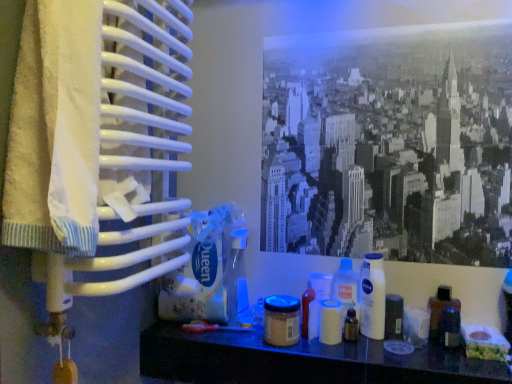
Question: In terms of width, does monochrome cityscape at upper center look wider or thinner when compared to translucent plastic tube at center, the fifth toiletry from the right?

Choices:
 (A) thin
 (B) wide

Answer: (A)

Question: From a real-world perspective, is monochrome cityscape at upper center physically located above or below translucent plastic tube at center, the fifth toiletry from the right?

Choices:
 (A) below
 (B) above

Answer: (B)

Question: Considering the real-world distances, which object is farthest from the brown matte jar at center, the sixth toiletry from the right?

Choices:
 (A) white plastic jar at center, the 5th toiletry when ordered from left to right
 (B) matte plastic shelf at lower center
 (C) monochrome cityscape at upper center
 (D) translucent plastic bottle at lower right, the first bottle when ordered from right to left
 (E) white plastic bottle at center-right, which is counted as the second bottle, starting from the right

Answer: (C)

Question: Based on their relative distances, which object is nearer to the matte plastic shelf at lower center?

Choices:
 (A) brown matte jar at center, the sixth toiletry from the right
 (B) translucent plastic bottle at lower right, the first bottle when ordered from right to left
 (C) transparent plastic bottle at center, the seventh toiletry viewed from the right
 (D) translucent plastic bottle at lower center, arranged as the 6th toiletry when viewed from the left
 (E) monochrome cityscape at upper center

Answer: (A)